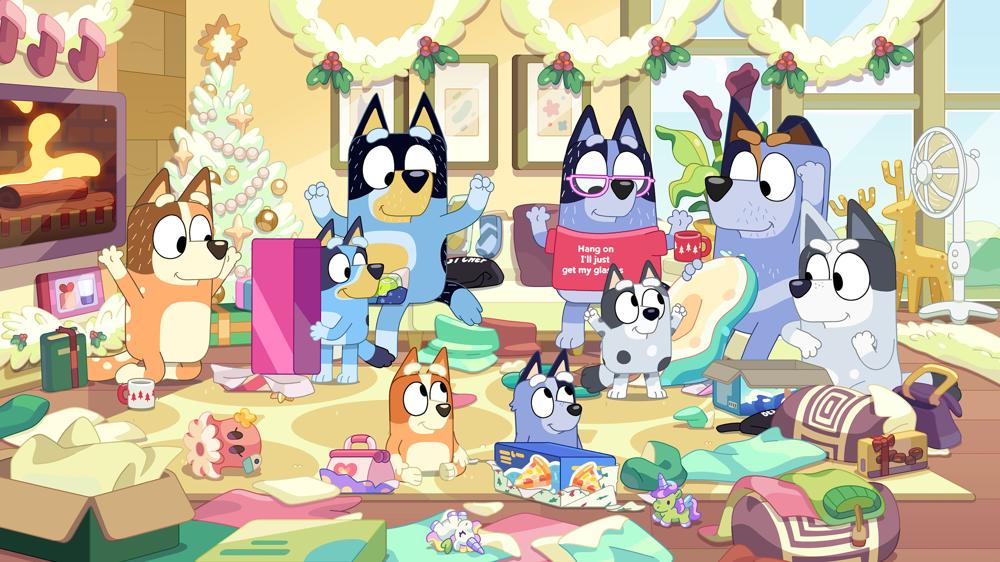
Identify the location of fireplace. 59,152.